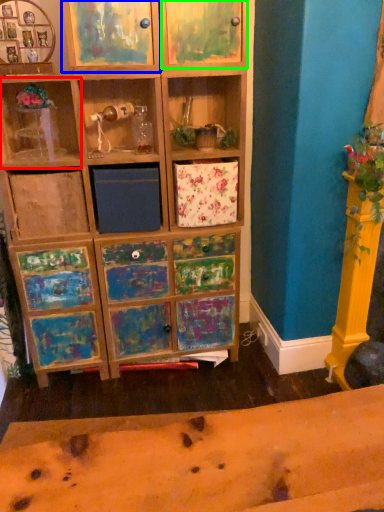
Question: Based on their relative distances, which object is nearer to shelf (highlighted by a red box)? Choose from cabinet (highlighted by a blue box) and cabinet (highlighted by a green box).

Choices:
 (A) cabinet
 (B) cabinet

Answer: (A)